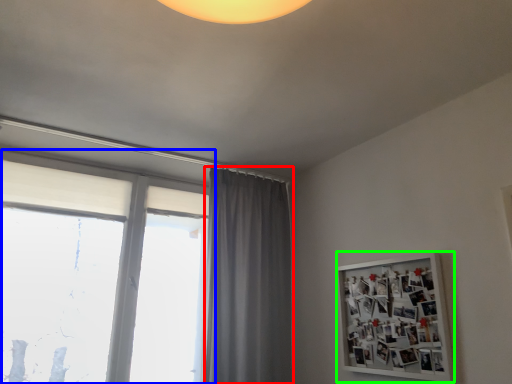
Question: Estimate the real-world distances between objects in this image. Which object is farther from curtain (highlighted by a red box), window (highlighted by a blue box) or bulletin board (highlighted by a green box)?

Choices:
 (A) window
 (B) bulletin board

Answer: (B)